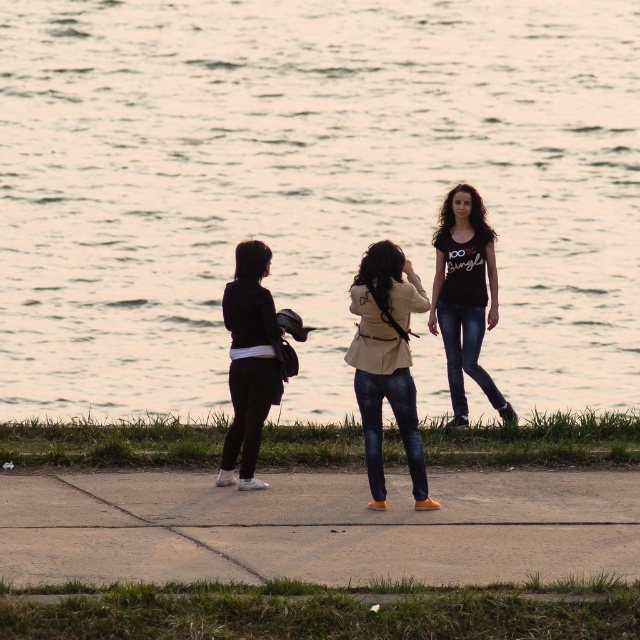
Question: Is green grass at lower center above dark blue denim jeans at center?

Choices:
 (A) yes
 (B) no

Answer: (B)

Question: Which object is farther from the camera taking this photo?

Choices:
 (A) black matte jacket at center
 (B) shiny silver water at center
 (C) concrete at center

Answer: (A)

Question: Which object is farther from the camera taking this photo?

Choices:
 (A) shiny silver water at center
 (B) jeans at center

Answer: (B)

Question: Can you confirm if green grass at lower center is wider than black matte jacket at center?

Choices:
 (A) no
 (B) yes

Answer: (B)

Question: Is concrete at center further to camera compared to jeans at center?

Choices:
 (A) no
 (B) yes

Answer: (A)

Question: Which is farther from the black matte jacket at center?

Choices:
 (A) black matte shirt at center
 (B) jeans at center
 (C) denim jacket at center
 (D) shiny silver water at center

Answer: (D)